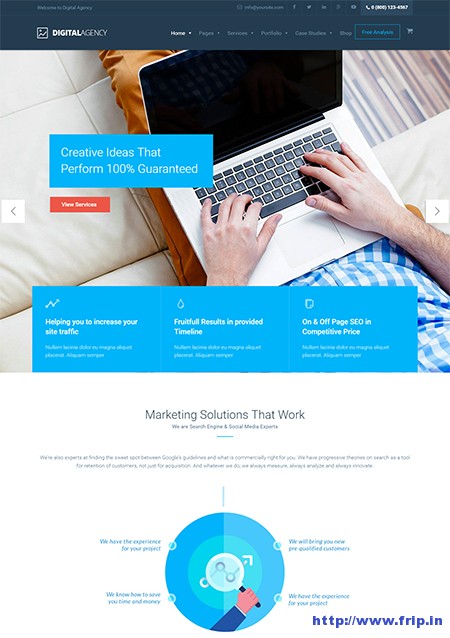
I want to click on lap top, so (337, 115).